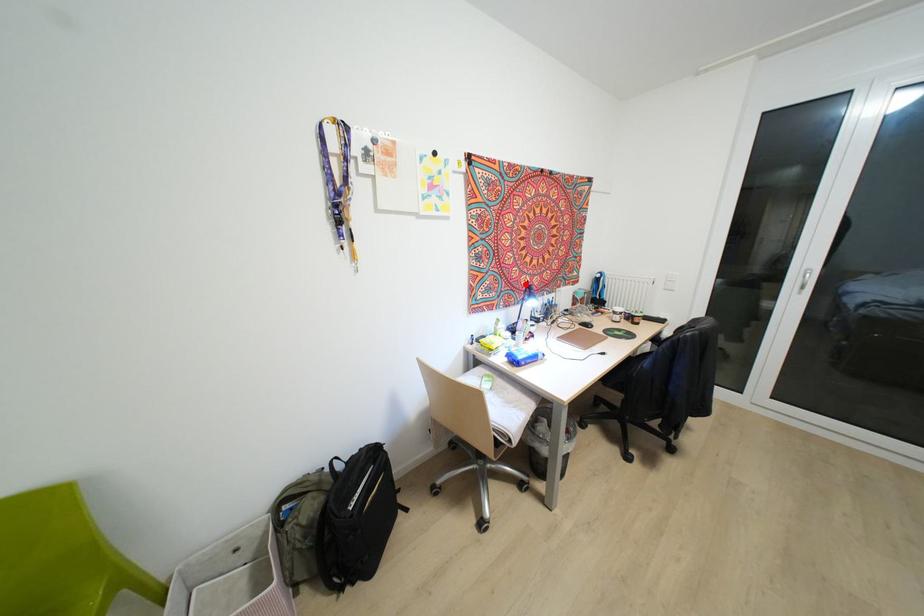
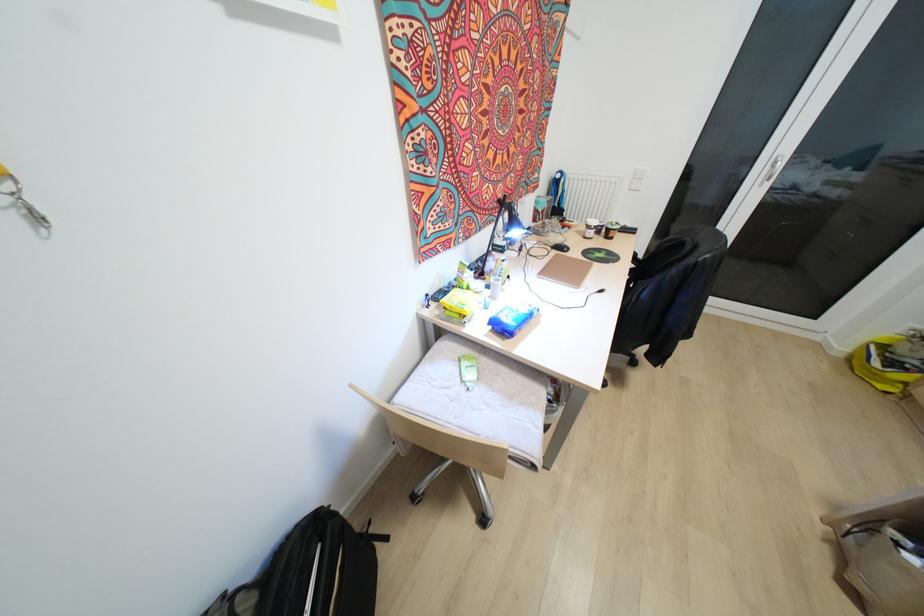
Question: I am providing you with two images of the same scene from different viewpoints. In image1, a red point is highlighted. Considering the same 3D point in image2, which of the following is correct?

Choices:
 (A) It is closer
 (B) It is farther

Answer: (A)